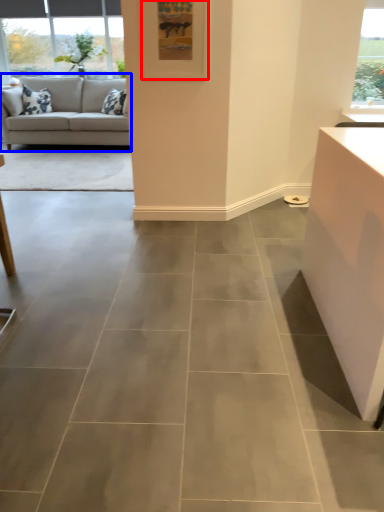
Question: Which object appears farthest to the camera in this image, picture frame (highlighted by a red box) or studio couch (highlighted by a blue box)?

Choices:
 (A) picture frame
 (B) studio couch

Answer: (B)